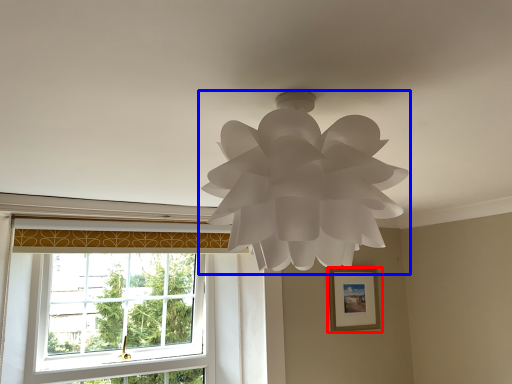
Question: Among these objects, which one is nearest to the camera, picture frame (highlighted by a red box) or lamp (highlighted by a blue box)?

Choices:
 (A) picture frame
 (B) lamp

Answer: (B)